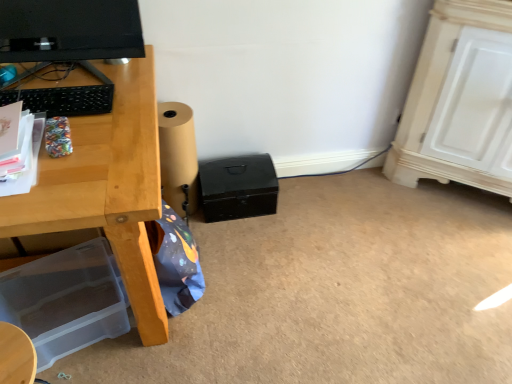
Question: Is brown paper roll at lower center inside the boundaries of black matte box at center, the 1th box positioned from the top, or outside?

Choices:
 (A) outside
 (B) inside

Answer: (A)

Question: Is brown paper roll at lower center in front of or behind black matte box at center, the 1th box when ordered from back to front, in the image?

Choices:
 (A) front
 (B) behind

Answer: (A)

Question: Which of these objects is positioned closest to the matte black monitor at upper left?

Choices:
 (A) brown paper roll at lower center
 (B) black matte box at center, the 1th box positioned from the top
 (C) transparent plastic storage box at lower left, the second box viewed from the top

Answer: (A)

Question: Based on their relative distances, which object is farther from the matte black monitor at upper left?

Choices:
 (A) brown paper roll at lower center
 (B) black matte box at center, which is counted as the second box, starting from the left
 (C) transparent plastic storage box at lower left, placed as the 1th box when sorted from front to back

Answer: (C)